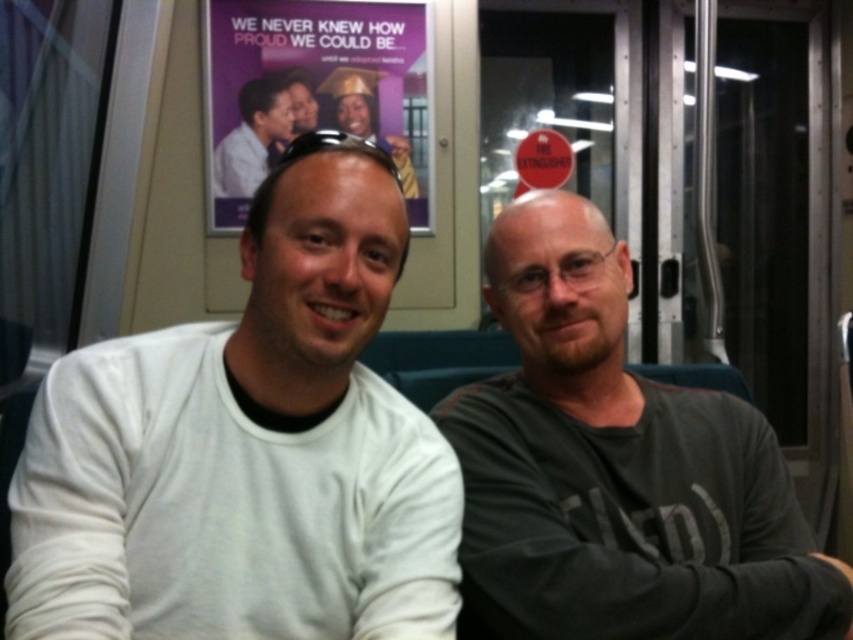
Does dark gray cotton shirt at center have a lesser width compared to matte gray shirt at upper center?

In fact, dark gray cotton shirt at center might be wider than matte gray shirt at upper center.

From the picture: Who is taller, dark gray cotton shirt at center or matte gray shirt at upper center?

A: dark gray cotton shirt at center is taller.

Find the location of a particular element. dark gray cotton shirt at center is located at coordinates (618, 468).

I want to click on dark gray cotton shirt at center, so click(x=618, y=468).

Is purple paper poster at upper center thinner than matte gray shirt at upper center?

Incorrect, purple paper poster at upper center's width is not less than matte gray shirt at upper center's.

The height and width of the screenshot is (640, 853). What are the coordinates of `purple paper poster at upper center` in the screenshot? It's located at (311, 90).

Who is higher up, white matte shirt at center or matte gray shirt at upper center?

matte gray shirt at upper center

Who is more distant from viewer, (x=142, y=380) or (x=242, y=134)?

The point (x=242, y=134) is behind.

Locate an element on the screen. white matte shirt at center is located at coordinates (247, 449).